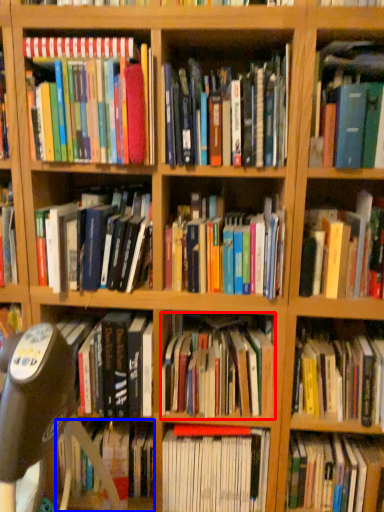
Question: Among these objects, which one is farthest to the camera, book (highlighted by a red box) or book (highlighted by a blue box)?

Choices:
 (A) book
 (B) book

Answer: (B)